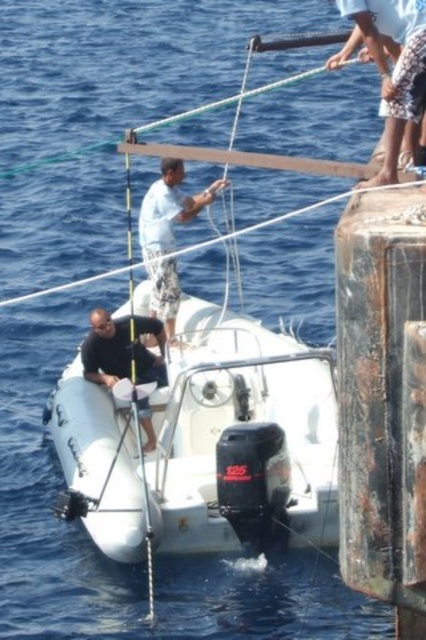
What do you see at coordinates (394, 64) in the screenshot?
I see `white woven rope at upper right` at bounding box center [394, 64].

Does white woven rope at upper right have a smaller size compared to white cotton shirt at center?

Yes.

Who is more distant from viewer, (x=379, y=40) or (x=164, y=163)?

Point (x=164, y=163)

Identify the location of white woven rope at upper right. This screenshot has width=426, height=640. (394, 64).

Which of these two, white rubber dinghy at center or white cotton shirt at center, stands shorter?

white rubber dinghy at center

Which of these two, white rubber dinghy at center or white cotton shirt at center, stands taller?

Standing taller between the two is white cotton shirt at center.

Is point (78, 365) in front of point (204, 195)?

Yes, it is in front of point (204, 195).

Identify the location of white rubber dinghy at center. (207, 444).

Which is below, white rubber dinghy at center or white woven rope at upper right?

white rubber dinghy at center

Does white rubber dinghy at center appear on the right side of white woven rope at upper right?

In fact, white rubber dinghy at center is to the left of white woven rope at upper right.

Who is more forward, (287, 410) or (406, 4)?

Point (406, 4)

The image size is (426, 640). What are the coordinates of `white rubber dinghy at center` in the screenshot? It's located at (207, 444).